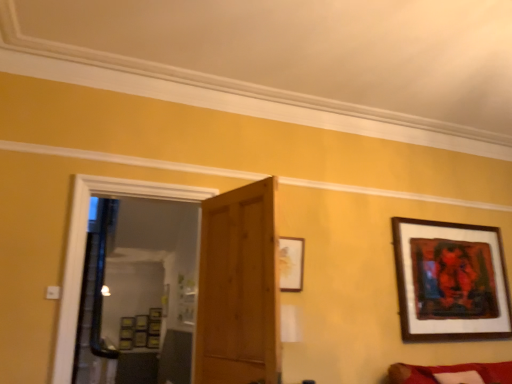
Question: Can you confirm if wooden picture frame at center, the first picture frame when ordered from left to right, is smaller than matte gold picture frame at upper center, which is the third picture frame in left-to-right order?

Choices:
 (A) no
 (B) yes

Answer: (B)

Question: Is matte gold picture frame at upper center, which is the third picture frame in left-to-right order, located within wooden picture frame at center, the first picture frame when ordered from left to right?

Choices:
 (A) no
 (B) yes

Answer: (A)

Question: Can you confirm if wooden picture frame at center, the second picture frame in the back-to-front sequence, is bigger than matte gold picture frame at upper center, arranged as the 4th picture frame when ordered from the bottom?

Choices:
 (A) yes
 (B) no

Answer: (B)

Question: Can you confirm if wooden picture frame at center, acting as the fourth picture frame starting from the right, is shorter than matte gold picture frame at upper center, which is counted as the 2th picture frame, starting from the right?

Choices:
 (A) no
 (B) yes

Answer: (B)

Question: Does wooden picture frame at center, the second picture frame in the back-to-front sequence, come in front of matte gold picture frame at upper center, arranged as the 4th picture frame when ordered from the bottom?

Choices:
 (A) yes
 (B) no

Answer: (B)

Question: In terms of width, does wooden picture frame at center, the third picture frame when ordered from top to bottom, look wider or thinner when compared to wooden door at center?

Choices:
 (A) wide
 (B) thin

Answer: (B)

Question: Is point (157, 311) positioned closer to the camera than point (261, 288)?

Choices:
 (A) closer
 (B) farther

Answer: (B)

Question: Is wooden picture frame at center, arranged as the first picture frame when viewed from the back, inside or outside of wooden door at center?

Choices:
 (A) inside
 (B) outside

Answer: (B)

Question: Is wooden picture frame at center, which is counted as the 2th picture frame, starting from the bottom, taller or shorter than wooden door at center?

Choices:
 (A) short
 (B) tall

Answer: (A)

Question: From the image's perspective, is velvet red couch at lower right located above or below matte gold picture frame at upper center, which is counted as the 1th picture frame, starting from the front?

Choices:
 (A) above
 (B) below

Answer: (B)

Question: Considering the positions of point (412, 372) and point (287, 286), is point (412, 372) closer or farther from the camera than point (287, 286)?

Choices:
 (A) closer
 (B) farther

Answer: (B)

Question: Considering the positions of velvet red couch at lower right and matte gold picture frame at upper center, which is counted as the 2th picture frame, starting from the right, in the image, is velvet red couch at lower right bigger or smaller than matte gold picture frame at upper center, which is counted as the 2th picture frame, starting from the right,?

Choices:
 (A) small
 (B) big

Answer: (B)

Question: Is velvet red couch at lower right wider or thinner than matte gold picture frame at upper center, which is counted as the 1th picture frame, starting from the front?

Choices:
 (A) thin
 (B) wide

Answer: (B)

Question: In terms of size, does wooden framed artwork at upper right, placed as the 2th picture frame when sorted from front to back, appear bigger or smaller than transparent glass door at center?

Choices:
 (A) small
 (B) big

Answer: (A)

Question: From their relative heights in the image, would you say wooden framed artwork at upper right, placed as the 2th picture frame when sorted from front to back, is taller or shorter than transparent glass door at center?

Choices:
 (A) short
 (B) tall

Answer: (A)